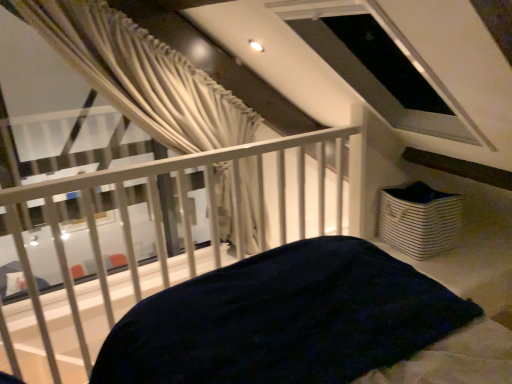
This screenshot has height=384, width=512. Find the location of `empty space that is ontop of white striped fabric basket at lower right (from a real-world perspective)`. empty space that is ontop of white striped fabric basket at lower right (from a real-world perspective) is located at coordinates (418, 199).